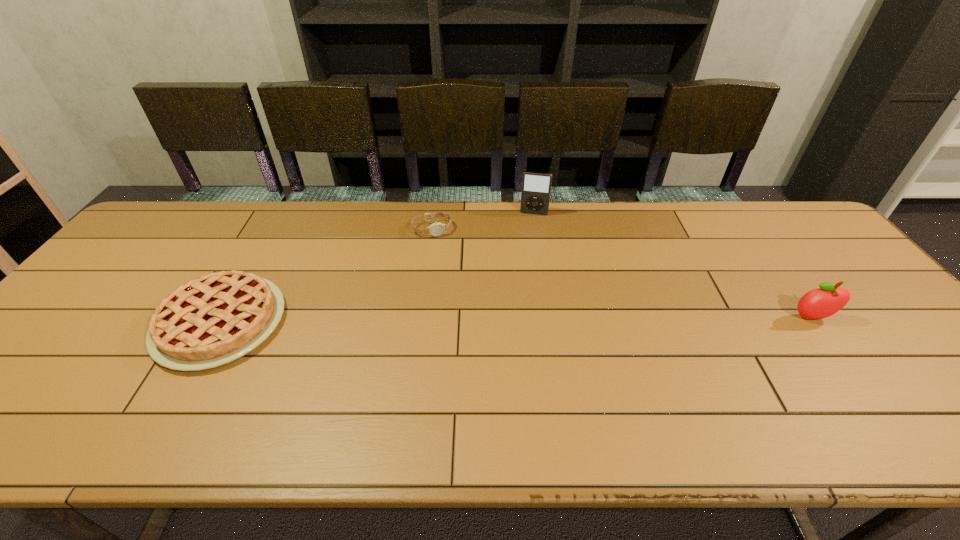
Image resolution: width=960 pixels, height=540 pixels. I want to click on free space that is in between the apple and the leftmost object, so click(516, 320).

The image size is (960, 540). In order to click on vacant area that lies between the third shortest object and the leftmost object in this screenshot , I will do `click(516, 320)`.

The image size is (960, 540). What are the coordinates of `blank region between the third shortest object and the farthest object` in the screenshot? It's located at (673, 266).

The height and width of the screenshot is (540, 960). Identify the location of empty space that is in between the apple and the third object from right to left. (622, 273).

This screenshot has height=540, width=960. What are the coordinates of `vacant region between the rightmost object and the third nearest object` in the screenshot? It's located at (622, 273).

Where is `object that ranks as the closest to the farthest object`? This screenshot has height=540, width=960. object that ranks as the closest to the farthest object is located at coordinates (436, 229).

Locate which object is the third closest to the farthest object. Please provide its 2D coordinates. Your answer should be formatted as a tuple, i.e. [(x, y)], where the tuple contains the x and y coordinates of a point satisfying the conditions above.

[(819, 303)]